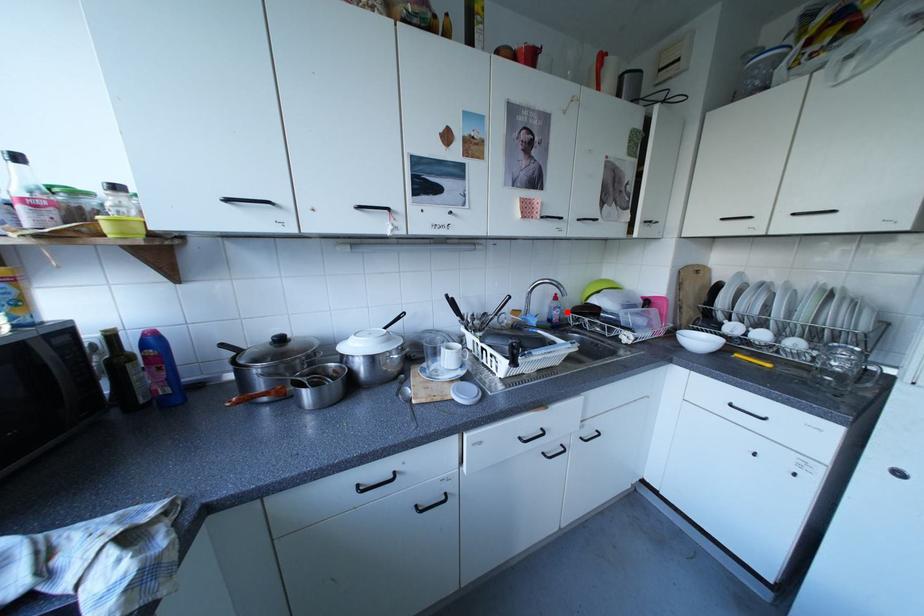
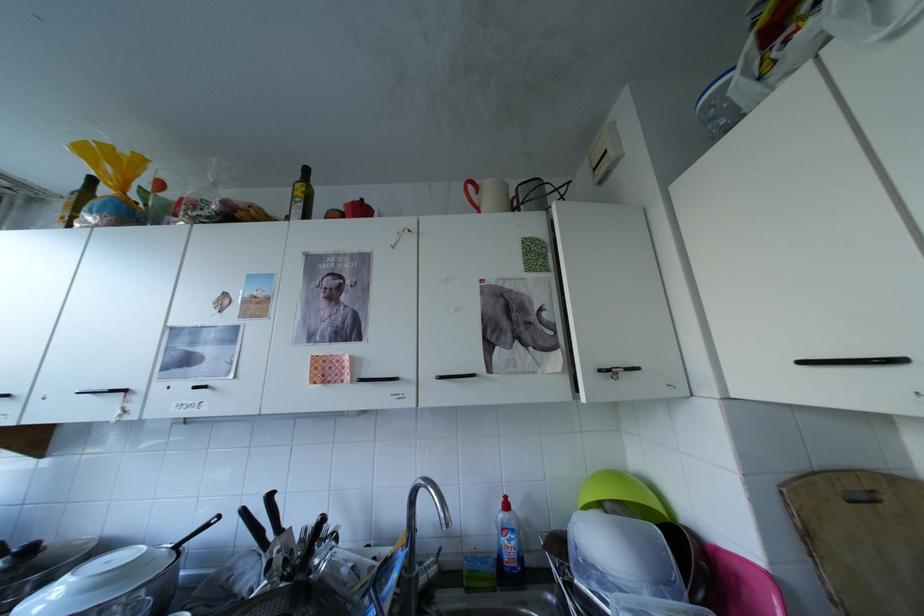
Locate, in the second image, the point that corresponds to the highlighted location in the first image.

(517, 541)